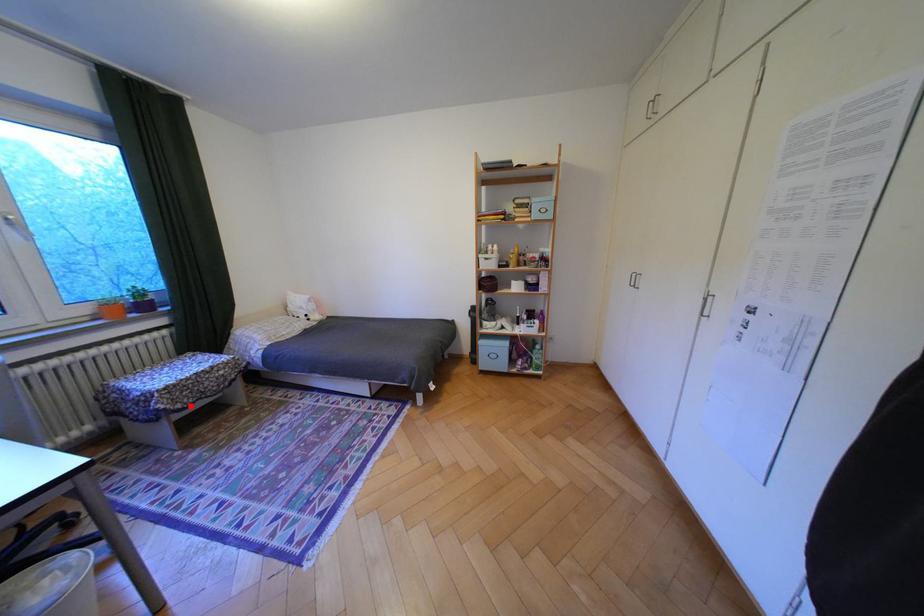
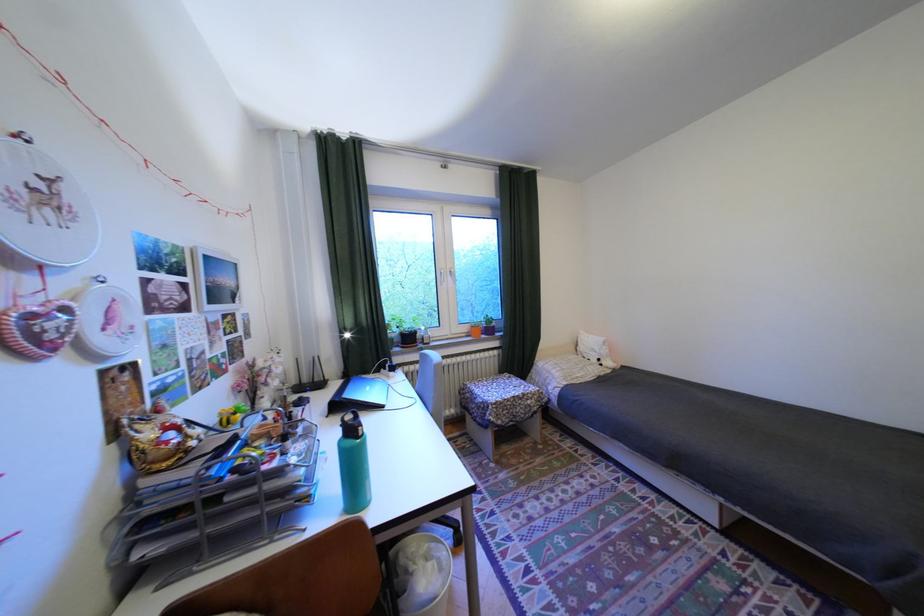
Question: I am providing you with two images of the same scene from different viewpoints. In image1, a red point is highlighted. Considering the same 3D point in image2, which of the following is correct?

Choices:
 (A) It is closer
 (B) It is farther

Answer: (B)